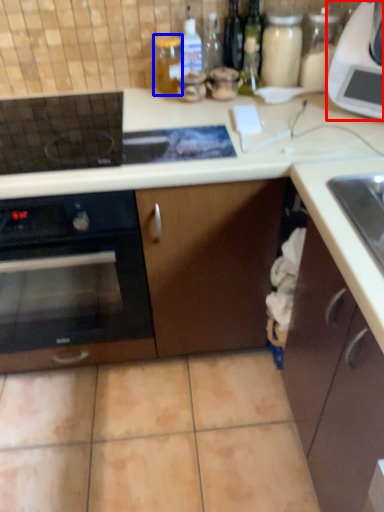
Question: Which point is closer to the camera, kitchen appliance (highlighted by a red box) or bottle (highlighted by a blue box)?

Choices:
 (A) kitchen appliance
 (B) bottle

Answer: (A)